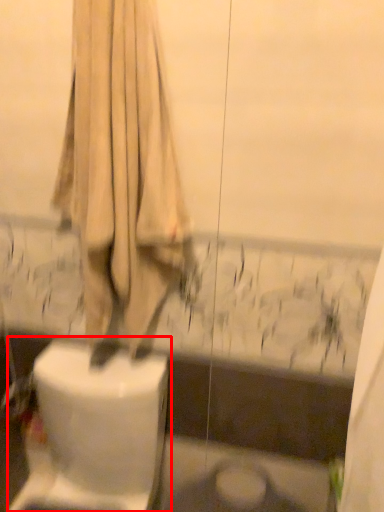
Question: From the image's perspective, what is the correct spatial relationship of toilet (annotated by the red box) in relation to curtain?

Choices:
 (A) below
 (B) above

Answer: (A)